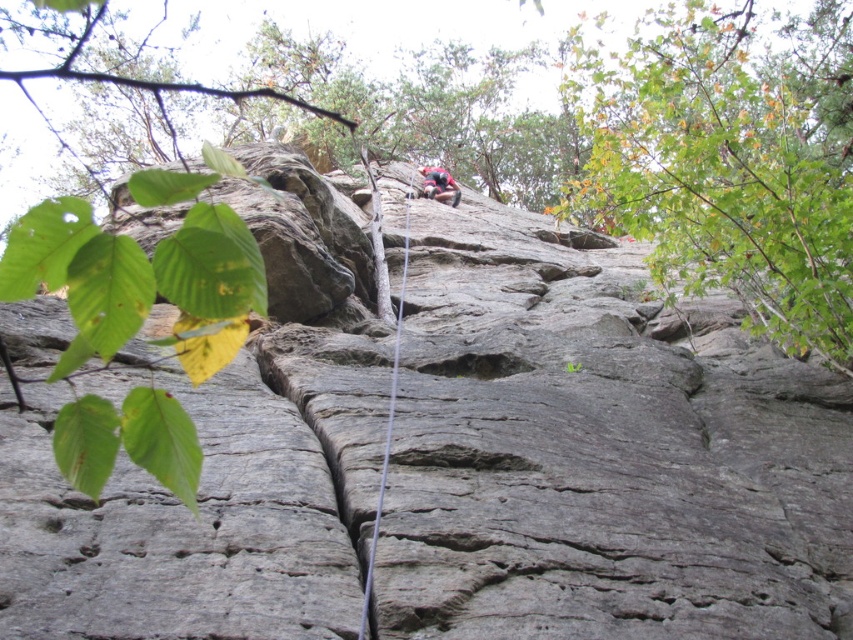
You are a climber looking at the steep rock face. There is a point marked at coordinates (140,282). What object is located at that point?

The point at coordinates (140,282) corresponds to a green leafy branch at upper left.